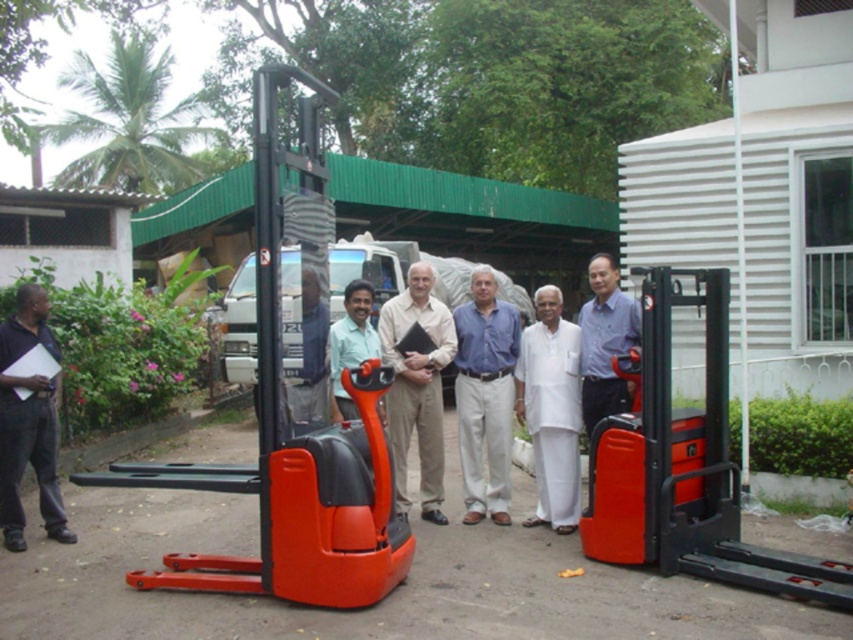
Measure the distance between point (619, 440) and camera.

Point (619, 440) is 5.28 meters away from camera.

Between orange matte forklift at right and beige cotton pants at center, which one appears on the left side from the viewer's perspective?

beige cotton pants at center

Does point (732, 545) lie behind point (425, 262)?

No.

You are a GUI agent. You are given a task and a screenshot of the screen. Output one action in this format:
    pyautogui.click(x=<x>, y=<y>)
    Task: Click on the orange matte forklift at right
    
    Given the screenshot: What is the action you would take?
    pyautogui.click(x=685, y=465)

Between point (573, 340) and point (392, 445), which one is positioned behind?

The point (392, 445) is more distant.

Can you confirm if white cotton kurta at center is taller than beige cotton pants at center?

Incorrect, white cotton kurta at center's height is not larger of beige cotton pants at center's.

Find the location of `white cotton kurta at center`. white cotton kurta at center is located at coordinates coord(550,410).

Can you confirm if beige cotton pants at center is wider than blue shirt at center?

Incorrect, beige cotton pants at center's width does not surpass blue shirt at center's.

Is point (401, 497) positioned after point (589, 419)?

Yes, point (401, 497) is behind point (589, 419).

Where is `beige cotton pants at center`? The width and height of the screenshot is (853, 640). beige cotton pants at center is located at coordinates (416, 387).